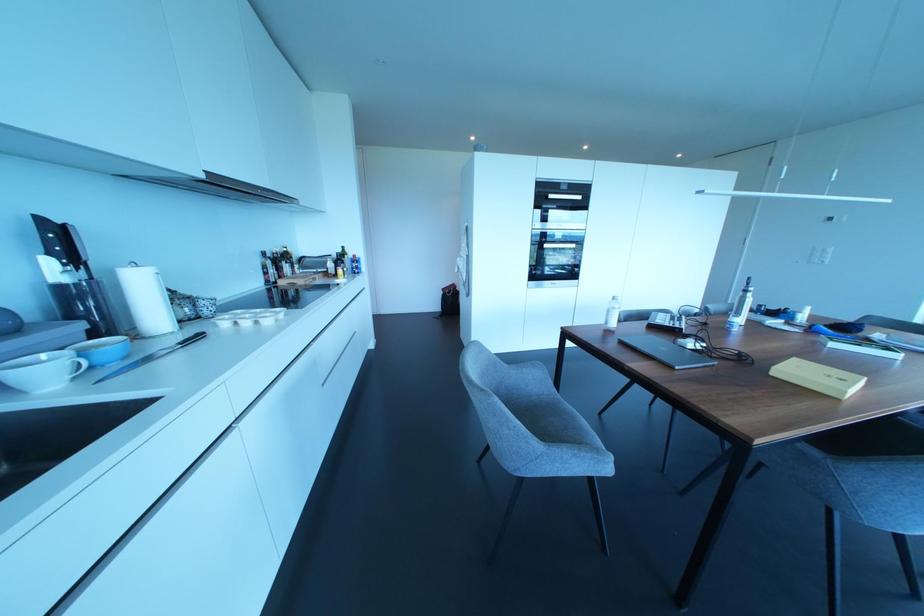
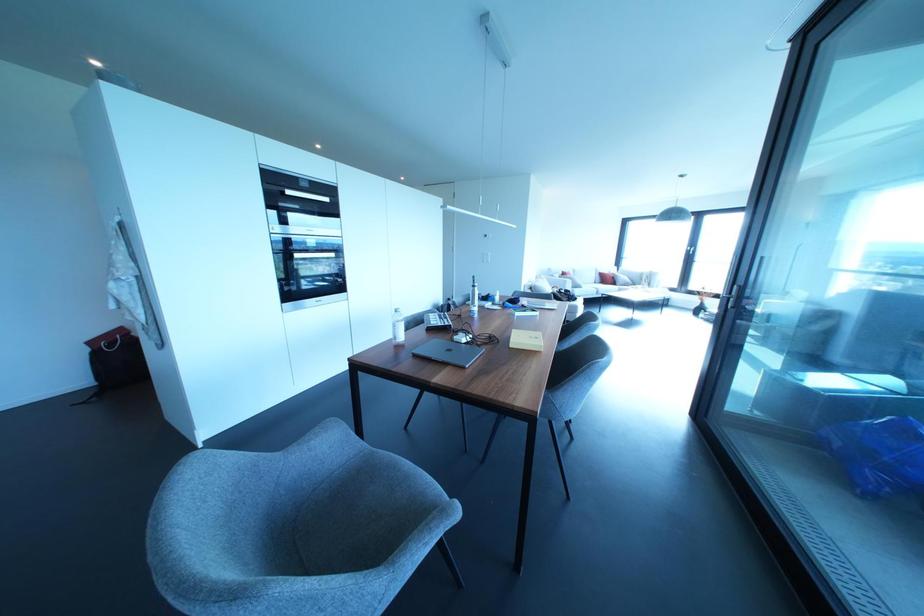
In the second image, find the point that corresponds to point (603, 551) in the first image.

(458, 585)